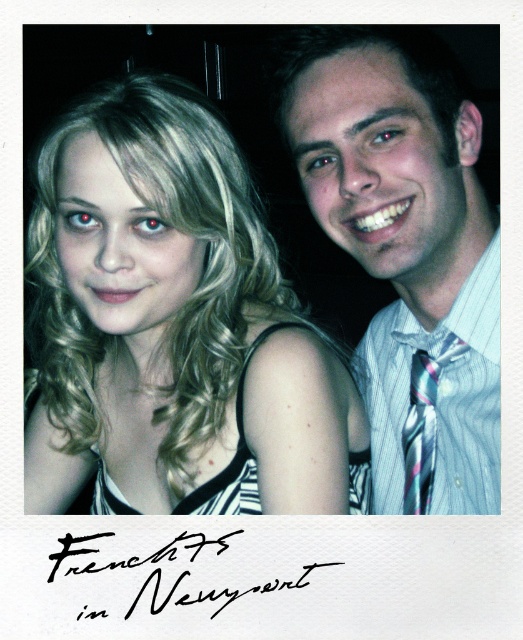
You are an archivist examining this vintage Polaroid photograph. You notice the blonde hair at center and the black ink signature at center. Which of these two elements is more prominent in terms of size?

The blonde hair at center has a larger size compared to the black ink signature at center, making it more prominent in terms of size.

Looking at this image, you are a photographer trying to edit this Polaroid photo. You want to adjust the focus so that the multicolored silk tie at right is more prominent than the blonde hair at center. Is the current positioning of the objects making this adjustment feasible?

The blonde hair at center is in front of the multicolored silk tie at right, so adjusting the focus to make the multicolored silk tie at right more prominent may be challenging due to its position behind the blonde hair at center.

In the vintage Polaroid photo, there are two people. The person on the left has blonde hair at center, and the person on the right is wearing a multicolored silk tie at right. Based on their positions, which object is higher in the image?

The blonde hair at center is above the multicolored silk tie at right, so the blonde hair at center is higher in the image.